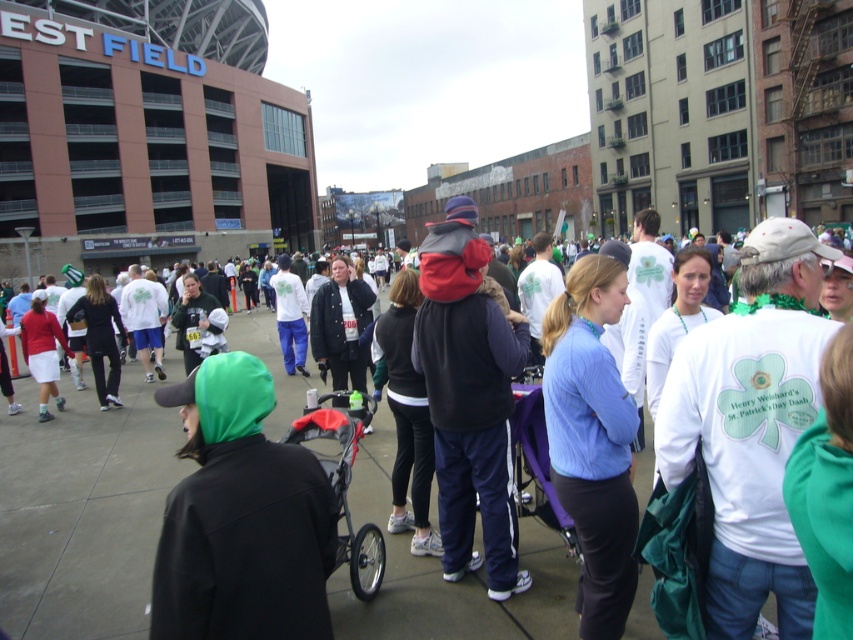
Is point (569, 566) farther from camera compared to point (442, 460)?

Yes, it is behind point (442, 460).

Which is more to the right, matte black jacket at center or dark blue fleece vest at center?

Positioned to the right is dark blue fleece vest at center.

Who is more distant from viewer, (97, 502) or (460, 531)?

Point (97, 502)

Image resolution: width=853 pixels, height=640 pixels. Identify the location of matte black jacket at center. (83, 509).

Which of these two, dark blue fleece vest at center or blue fleece jacket at center, stands taller?

dark blue fleece vest at center is taller.

Is point (488, 452) more distant than point (579, 378)?

Yes, it is behind point (579, 378).

Where is `dark blue fleece vest at center`? The image size is (853, 640). dark blue fleece vest at center is located at coordinates (469, 397).

Based on the photo, between green matte hood at center and red plastic baby carriage at center, which one has less height?

Standing shorter between the two is green matte hood at center.

This screenshot has height=640, width=853. What do you see at coordinates (241, 516) in the screenshot?
I see `green matte hood at center` at bounding box center [241, 516].

What are the coordinates of `green matte hood at center` in the screenshot? It's located at (241, 516).